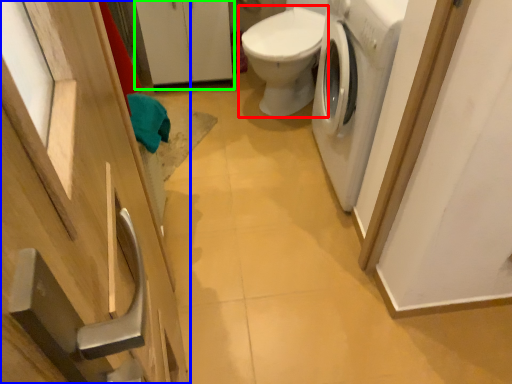
Question: Which object is the closest to the toilet (highlighted by a red box)? Choose among these: cabinetry (highlighted by a blue box) or cabinetry (highlighted by a green box).

Choices:
 (A) cabinetry
 (B) cabinetry

Answer: (B)